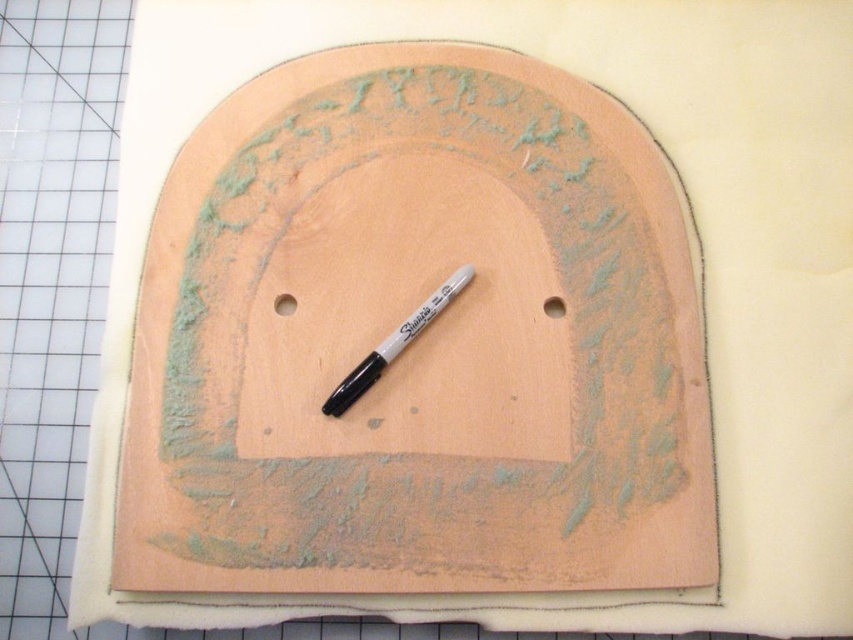
You have a small toy car that is 10 centimeters long. You want to place it on the peach wood board at center so that it doesn t fall through the smooth orange wood hole at center. Is this possible?

The peach wood board at center is wider than the smooth orange wood hole at center, so placing the toy car on the board will prevent it from falling through the hole as long as the car stays on the board.

You are looking at the fabric with a semi circular cut out and a Sharpie marker in the center. There are two points marked on the fabric. Which point is closer to you, point (283, 314) or point (550, 314)?

Point (283, 314) is closer to the viewer than point (550, 314).

You are arranging items on a table and need to place a Sharpie marker. The peach wood board at center is already there. Where should you place the black marker at center so it doesn

The peach wood board at center is in front of the black marker at center, so to place the black marker at center behind the peach wood board at center.